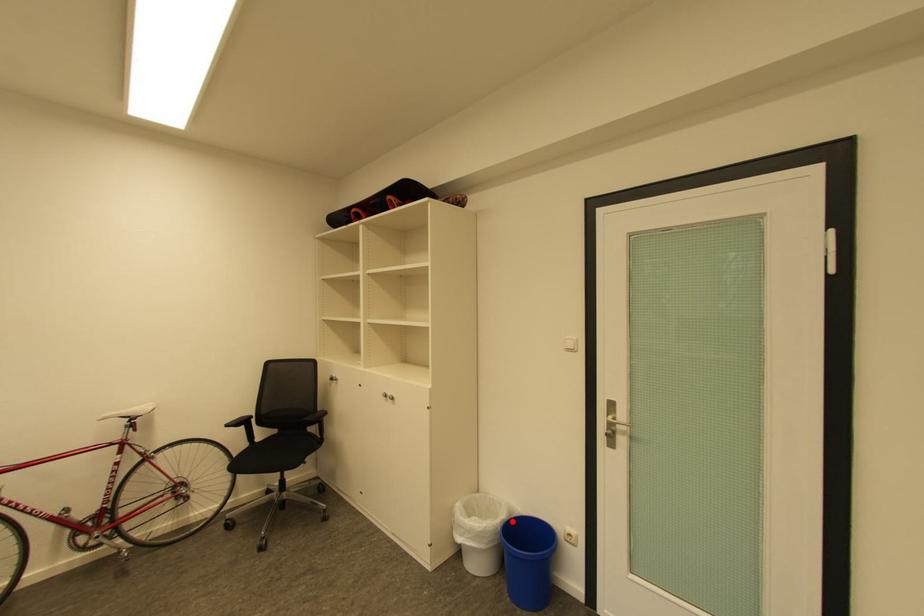
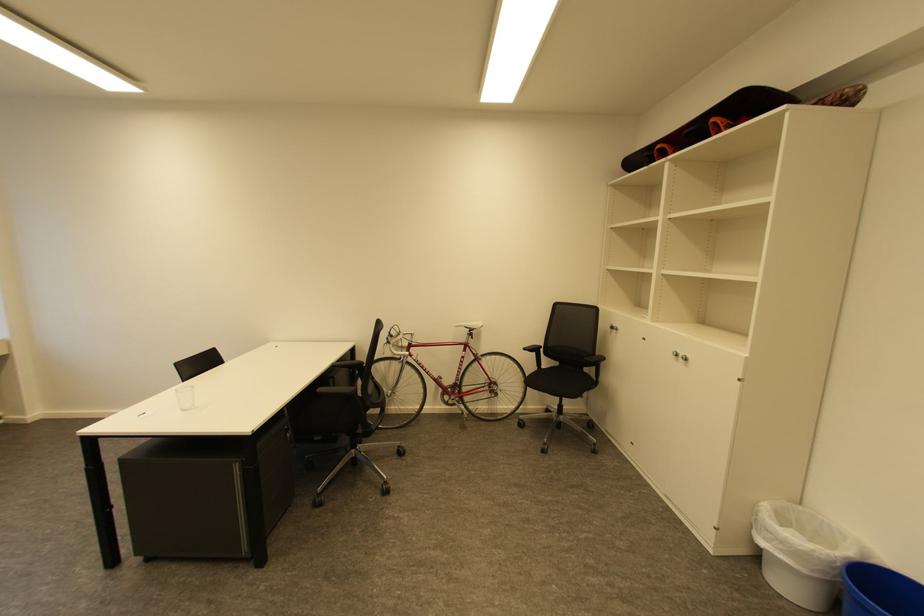
Locate, in the second image, the point that corresponds to the highlighted location in the first image.

(860, 561)